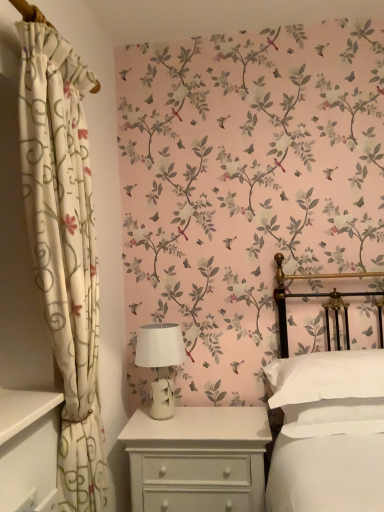
Question: Is white soft pillow at right wider or thinner than white floral fabric curtain at left?

Choices:
 (A) thin
 (B) wide

Answer: (B)

Question: Would you say white soft pillow at right is to the left or to the right of white floral fabric curtain at left in the picture?

Choices:
 (A) left
 (B) right

Answer: (B)

Question: Estimate the real-world distances between objects in this image. Which object is farther from the white painted wood nightstand at lower center?

Choices:
 (A) white floral fabric curtain at left
 (B) white soft pillow at right
 (C) white ceramic table lamp at center

Answer: (A)

Question: Which of these objects is positioned closest to the white floral fabric curtain at left?

Choices:
 (A) white painted wood nightstand at lower center
 (B) white soft pillow at right
 (C) white ceramic table lamp at center

Answer: (A)